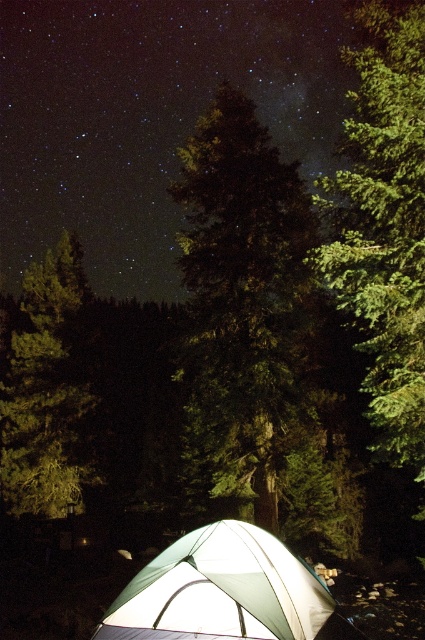
Question: Does green textured tree at center appear under white fabric tent at lower center?

Choices:
 (A) yes
 (B) no

Answer: (B)

Question: Does white fabric tent at lower center have a lesser width compared to green textured tree at left?

Choices:
 (A) yes
 (B) no

Answer: (A)

Question: Which point is farther to the camera?

Choices:
 (A) green textured tree at center
 (B) white fabric tent at lower center
 (C) green textured pine tree at upper right

Answer: (A)

Question: Estimate the real-world distances between objects in this image. Which object is closer to the green textured pine tree at upper right?

Choices:
 (A) white fabric tent at lower center
 (B) green textured tree at left

Answer: (A)

Question: Estimate the real-world distances between objects in this image. Which object is farther from the green textured pine tree at upper right?

Choices:
 (A) green textured tree at left
 (B) white fabric tent at lower center
 (C) green textured tree at center

Answer: (A)

Question: Is green textured tree at center further to camera compared to white fabric tent at lower center?

Choices:
 (A) yes
 (B) no

Answer: (A)